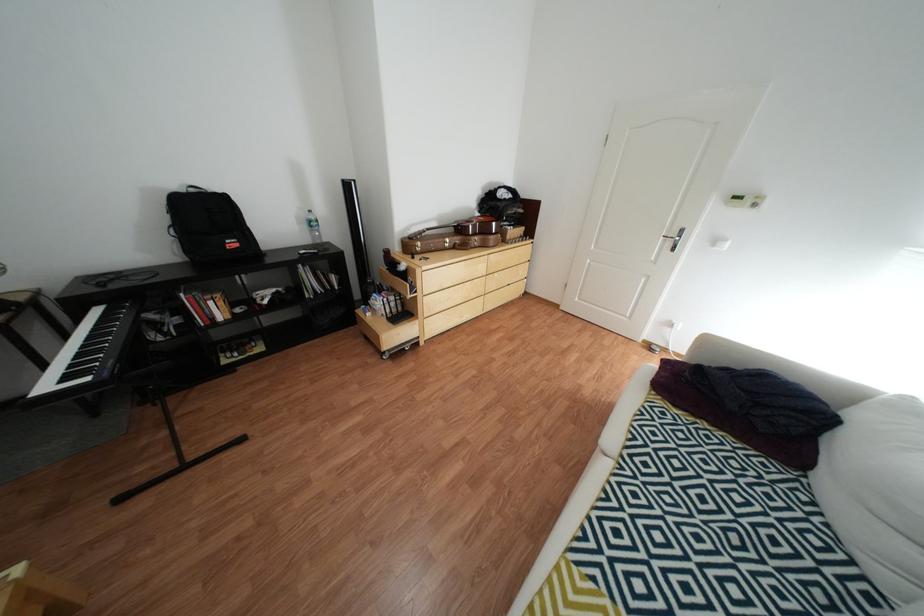
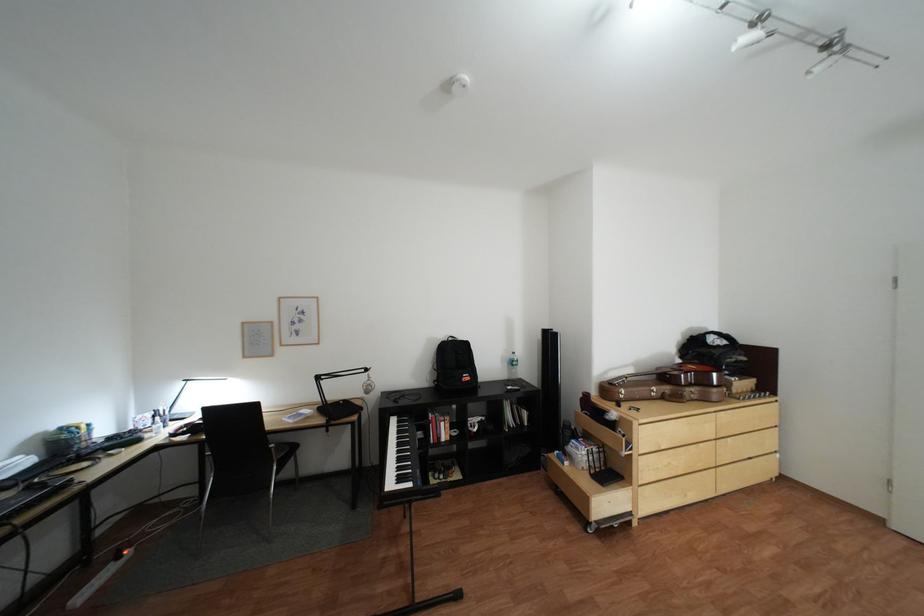
Question: I am providing you with two images of the same scene from different viewpoints. After the viewpoint changes to image2, which objects are now occluded?

Choices:
 (A) brown guitar case
 (B) chair sitting surface
 (C) clear water bottle
 (D) none of these

Answer: (D)